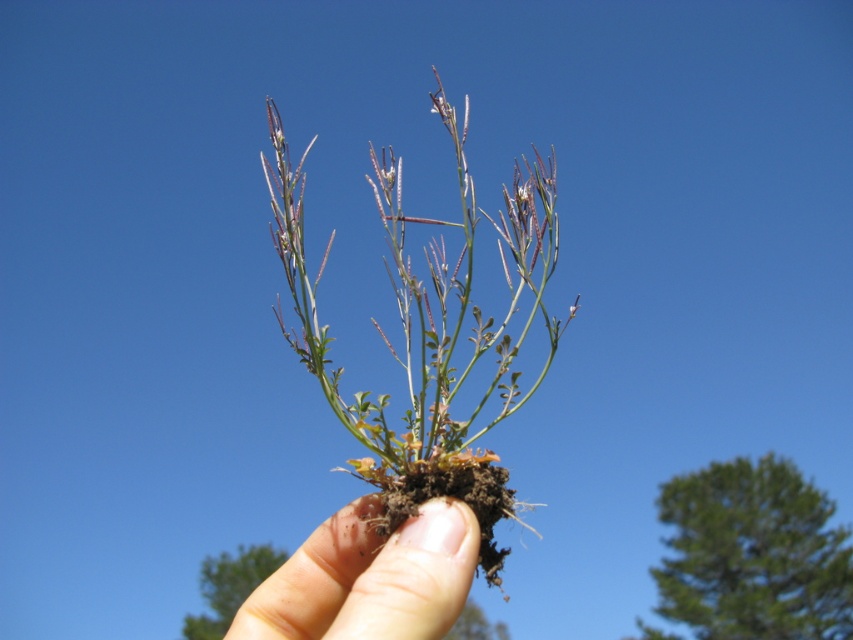
Question: Is green leafy plant at center behind smooth skin hand at center?

Choices:
 (A) no
 (B) yes

Answer: (B)

Question: Observing the image, what is the correct spatial positioning of green leafy plant at center in reference to smooth skin hand at center?

Choices:
 (A) above
 (B) below

Answer: (A)

Question: Is green leafy plant at center positioned before smooth skin hand at center?

Choices:
 (A) yes
 (B) no

Answer: (B)

Question: Which point appears closest to the camera in this image?

Choices:
 (A) (312, 540)
 (B) (369, 436)

Answer: (B)